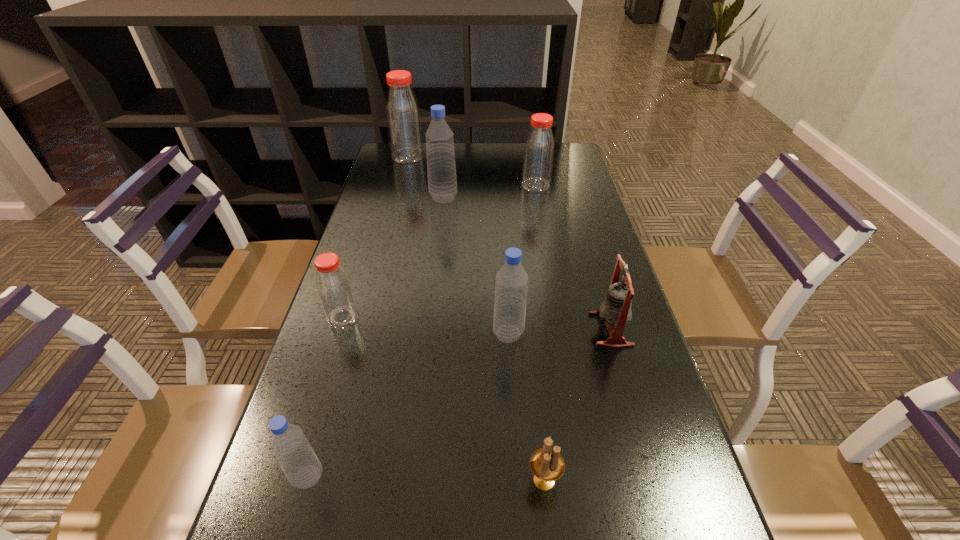
The height and width of the screenshot is (540, 960). What are the coordinates of `the fourth closest bottle relative to the rightmost blue bottle` in the screenshot? It's located at tap(538, 156).

The height and width of the screenshot is (540, 960). In order to click on the third closest blue bottle to the farthest bottle in this screenshot , I will do `click(297, 459)`.

Identify which blue bottle is the nearest to the second biggest red bottle. Please provide its 2D coordinates. Your answer should be formatted as a tuple, i.e. [(x, y)], where the tuple contains the x and y coordinates of a point satisfying the conditions above.

[(442, 183)]

Identify which red bottle is the closest to the nearest bottle. Please provide its 2D coordinates. Your answer should be formatted as a tuple, i.e. [(x, y)], where the tuple contains the x and y coordinates of a point satisfying the conditions above.

[(334, 288)]

Point out which red bottle is positioned as the third nearest to the rightmost blue bottle. Please provide its 2D coordinates. Your answer should be formatted as a tuple, i.e. [(x, y)], where the tuple contains the x and y coordinates of a point satisfying the conditions above.

[(403, 118)]